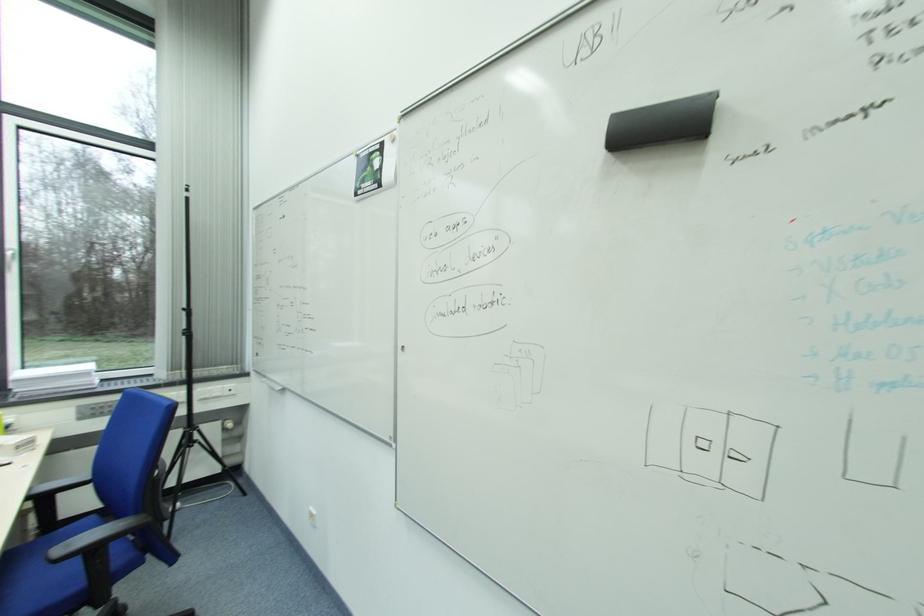
Identify the location of white window handle. (13, 262).